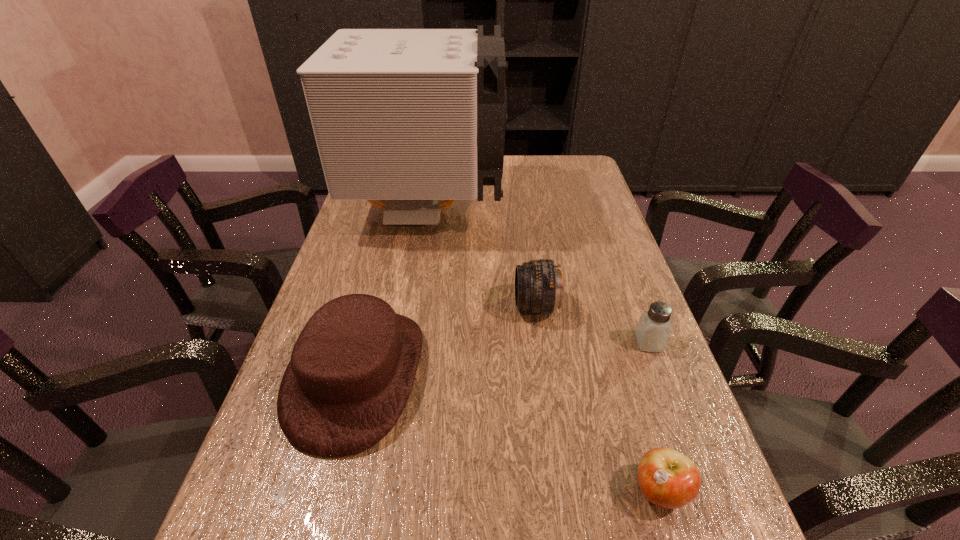
In the image, there is a desktop. Identify the location of vacant space at the left edge. (349, 260).

The image size is (960, 540). I want to click on free space at the right edge of the desktop, so click(x=589, y=202).

This screenshot has height=540, width=960. I want to click on free space between the third object from right to left and the shortest object, so click(598, 399).

The height and width of the screenshot is (540, 960). I want to click on free space that is in between the telephoto lens and the second shortest object, so click(592, 325).

The width and height of the screenshot is (960, 540). I want to click on free space that is in between the telephoto lens and the farthest object, so click(x=482, y=258).

Locate an element on the screen. vacant space in between the fan and the hat is located at coordinates (393, 292).

In order to click on vacant space that is in between the fourth tallest object and the telephoto lens in this screenshot , I will do `click(592, 325)`.

What are the coordinates of `free space between the telephoto lens and the fourth tallest object` in the screenshot? It's located at pyautogui.click(x=592, y=325).

The image size is (960, 540). Find the location of `free spot between the hat and the nearest object`. free spot between the hat and the nearest object is located at coordinates (509, 433).

Find the location of `vacant space in between the shortest object and the fan`. vacant space in between the shortest object and the fan is located at coordinates (544, 349).